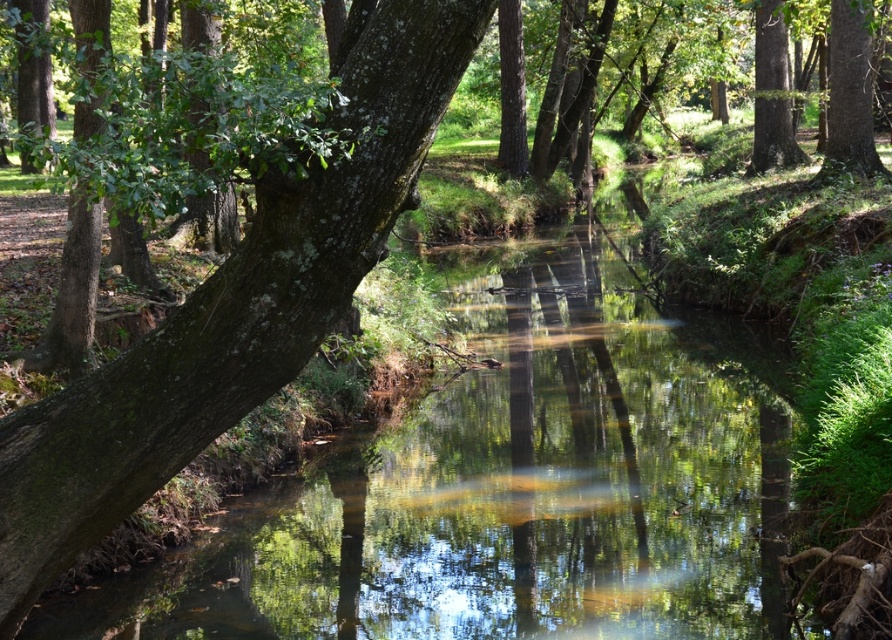
Who is taller, clear water at center or green rough bark tree at left?

green rough bark tree at left

Does clear water at center appear on the left side of green rough bark tree at left?

In fact, clear water at center is to the right of green rough bark tree at left.

Identify the location of clear water at center. Image resolution: width=892 pixels, height=640 pixels. (513, 481).